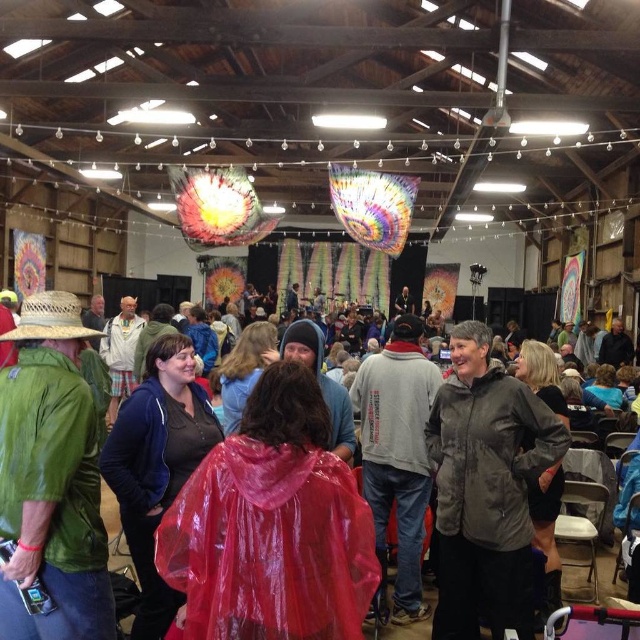
You are at the entrance of the barn and see the green leather jacket at left. If you want to reach it, how many steps would you need to take if each step covers about 2 feet?

The green leather jacket at left is 16.09 feet away from viewer. Since each step covers about 2 feet, you would need approximately 8 steps to reach it.

You are organizing a costume party and need to choose between the green leather jacket at left and the transparent plastic poncho at center. Which item would be more suitable for a larger costume?

The green leather jacket at left is larger in size compared to the transparent plastic poncho at center, making it more suitable for a larger costume.